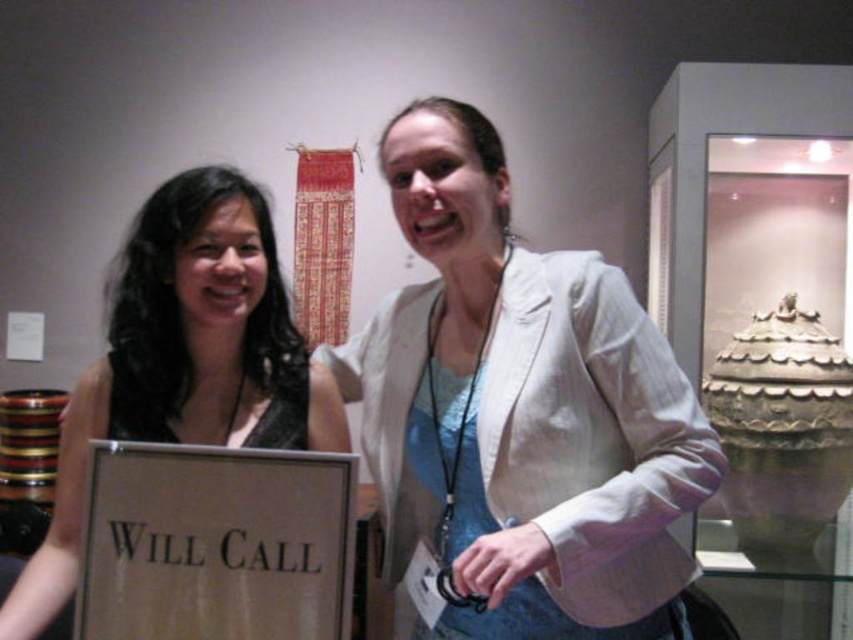
You are standing in the museum and see two points marked in the image. The first point is at coordinate point (527, 572) and the second is at point (242, 228). Which point is closer to you?

Point (527, 572) is in front of point (242, 228), so the first point is closer to you.

You are a fashion designer observing two outfits in a museum exhibit. You see a white textured blazer at center and a black satin dress at left. Which outfit has a larger size?

The white textured blazer at center is bigger than the black satin dress at left, so the white textured blazer at center has a larger size.